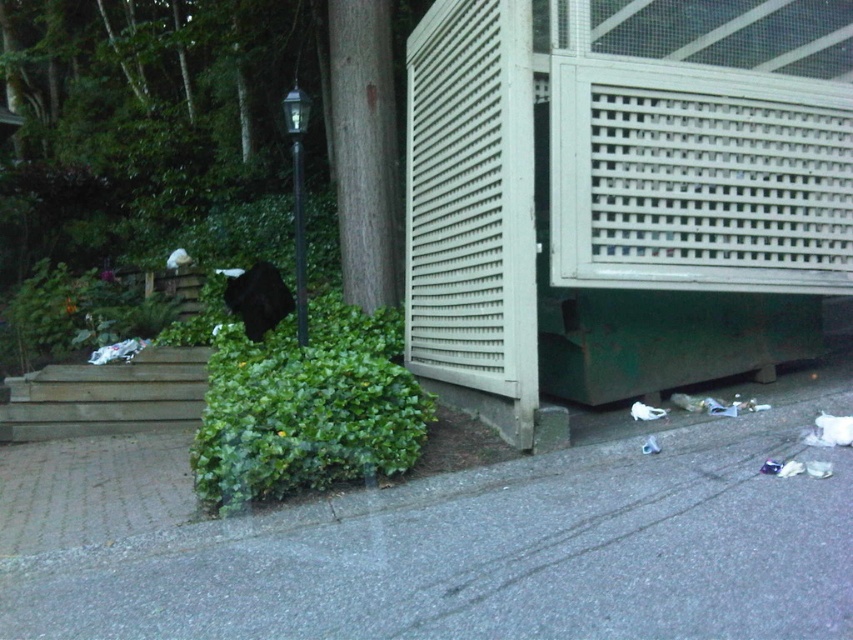
Question: Considering the real-world distances, which object is farthest from the wooden stairs at lower left?

Choices:
 (A) gray concrete pavement at lower center
 (B) green textured porch at lower right

Answer: (A)

Question: Is green textured porch at lower right bigger than gray concrete pavement at lower center?

Choices:
 (A) no
 (B) yes

Answer: (B)

Question: Does gray concrete pavement at lower center have a greater width compared to wooden stairs at lower left?

Choices:
 (A) no
 (B) yes

Answer: (B)

Question: Is gray concrete pavement at lower center closer to the viewer compared to wooden stairs at lower left?

Choices:
 (A) no
 (B) yes

Answer: (B)

Question: Based on their relative distances, which object is farther from the green textured porch at lower right?

Choices:
 (A) gray concrete pavement at lower center
 (B) wooden stairs at lower left

Answer: (B)

Question: Which point appears farthest from the camera in this image?

Choices:
 (A) (677, 84)
 (B) (76, 406)

Answer: (B)